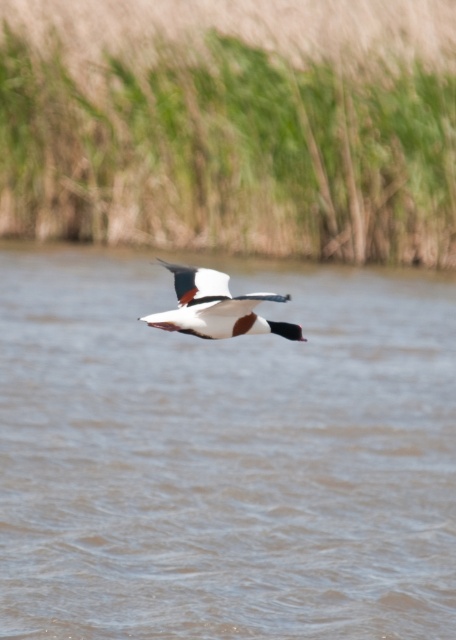
Does brown water at center lie behind white glossy bird at center?

No, it is not.

Between brown water at center and white glossy bird at center, which one appears on the right side from the viewer's perspective?

brown water at center

Where is `brown water at center`? This screenshot has width=456, height=640. brown water at center is located at coordinates click(224, 454).

Can you confirm if brown water at center is positioned below green grass at upper center?

Indeed, brown water at center is positioned under green grass at upper center.

Does point (76, 364) come behind point (190, 29)?

No, it is in front of (190, 29).

Locate an element on the screen. Image resolution: width=456 pixels, height=640 pixels. brown water at center is located at coordinates (224, 454).

Does green grass at upper center appear under white glossy bird at center?

No.

The width and height of the screenshot is (456, 640). Identify the location of green grass at upper center. [232, 125].